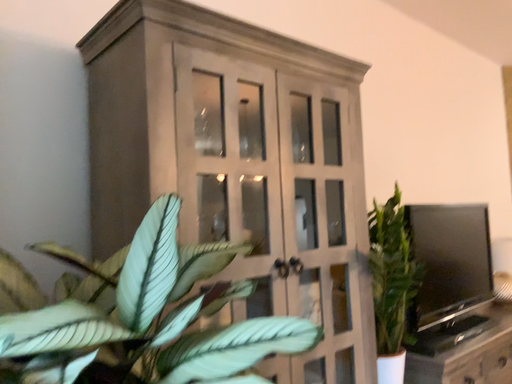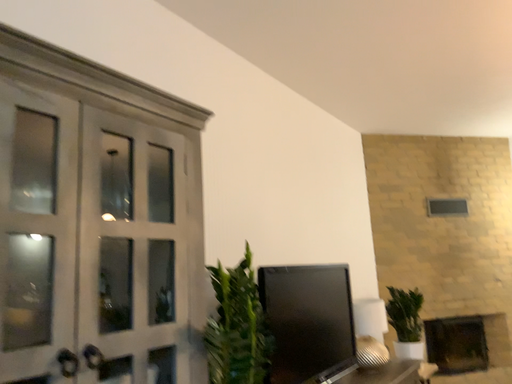
Question: Which way did the camera rotate in the video?

Choices:
 (A) rotated left
 (B) rotated right

Answer: (B)